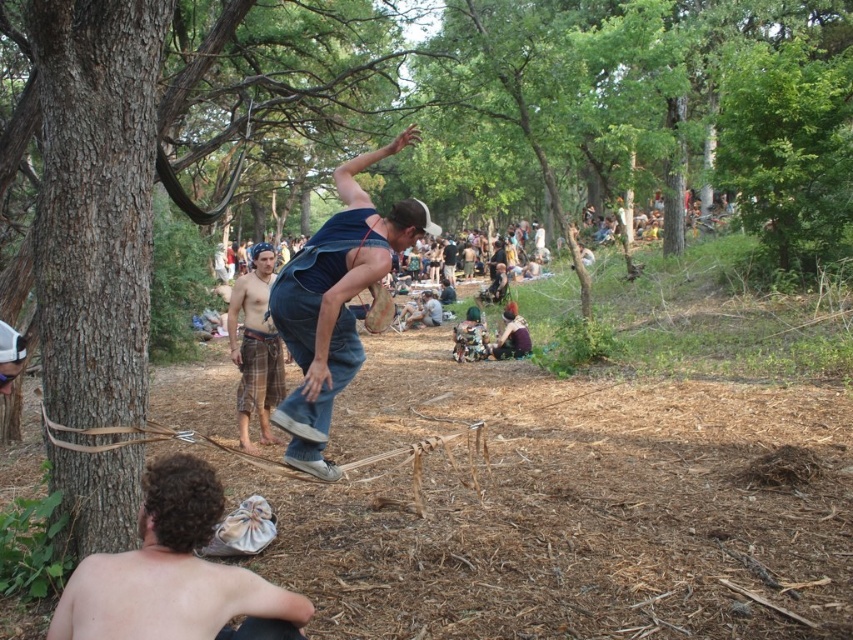
Question: Which object is farther from the camera taking this photo?

Choices:
 (A) denim overalls at center
 (B) curly hair at lower left
 (C) brown rough tree trunk at left

Answer: (C)

Question: Is curly hair at lower left wider than plaid fabric shorts at center?

Choices:
 (A) yes
 (B) no

Answer: (A)

Question: Among these points, which one is nearest to the camera?

Choices:
 (A) (363, 358)
 (B) (82, 148)
 (C) (248, 451)

Answer: (B)

Question: Can you confirm if brown rough tree trunk at left is thinner than denim overalls at center?

Choices:
 (A) no
 (B) yes

Answer: (B)

Question: Which is farther from the plaid fabric shorts at center?

Choices:
 (A) brown rough tree trunk at left
 (B) curly hair at lower left

Answer: (B)

Question: Is denim overalls at center positioned before plaid fabric shorts at center?

Choices:
 (A) yes
 (B) no

Answer: (A)